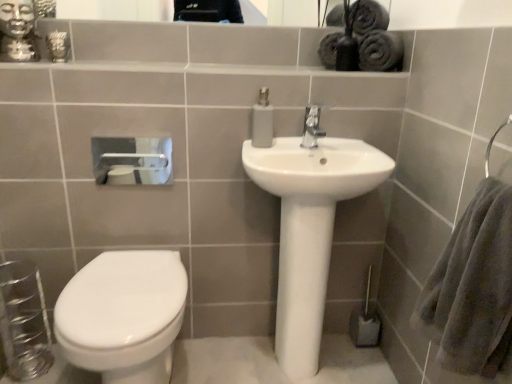
Where is `free point below white glossy sink at center (from a real-world perspective)`? free point below white glossy sink at center (from a real-world perspective) is located at coordinates (289, 370).